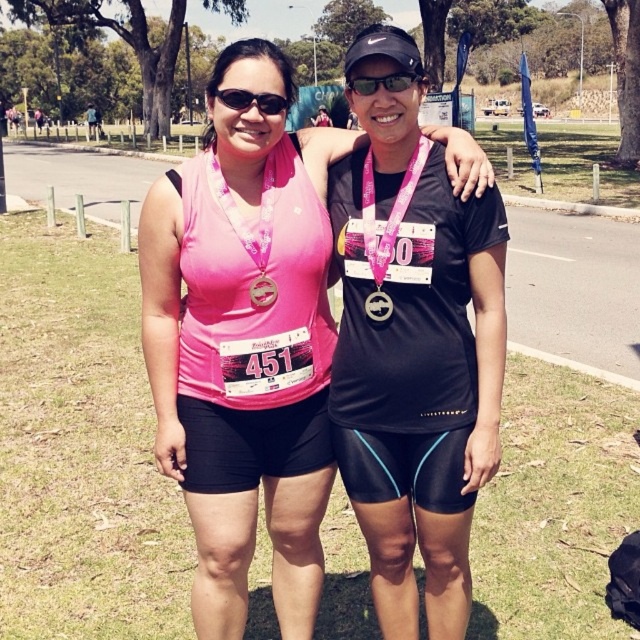
You are a photographer positioned at the back of the scene. You need to take a photo that includes both the matte black jersey at center and the matte black goggles at center. Given their sizes, which object should you focus on first to ensure both are in frame?

The matte black jersey at center has a greater height compared to matte black goggles at center. Therefore, focus on the matte black jersey at center first since it is taller and requires more space in the frame to capture fully.

You are a photographer trying to capture a closeup shot of both the matte black goggles at center and the pink fabric medal at center. Given that your camera can only focus on objects within a 60 cm range, will you be able to capture both in a single shot?

The distance between the matte black goggles at center and the pink fabric medal at center is 72.98 centimeters, which exceeds the camera focus range of 60 cm. Therefore, you cannot capture both in a single shot.

You are a photographer standing at the starting line of the race. You want to take a photo of the point at coordinates point (413, 362). Which object should you focus on?

The point (413, 362) is on the matte black jersey at center, so you should focus on the matte black jersey at center.